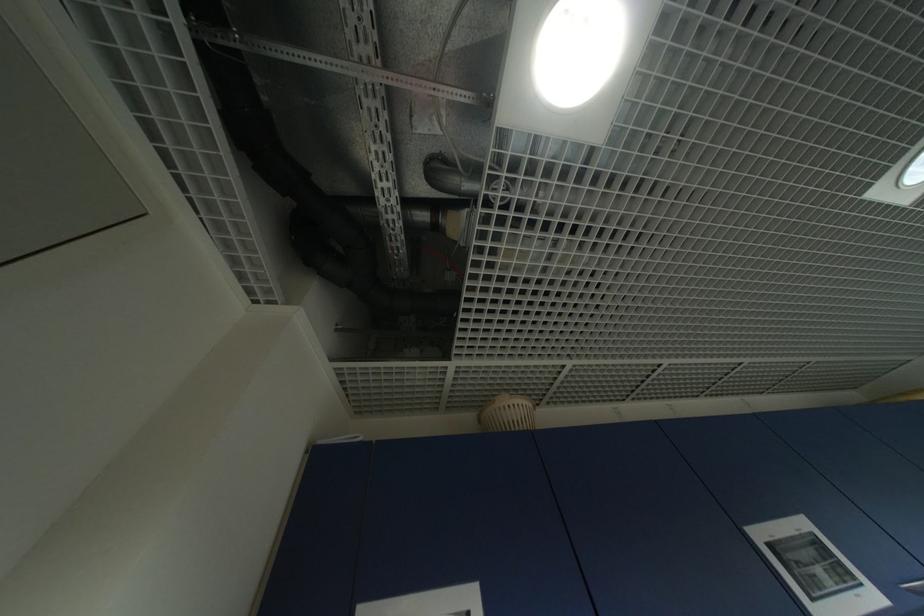
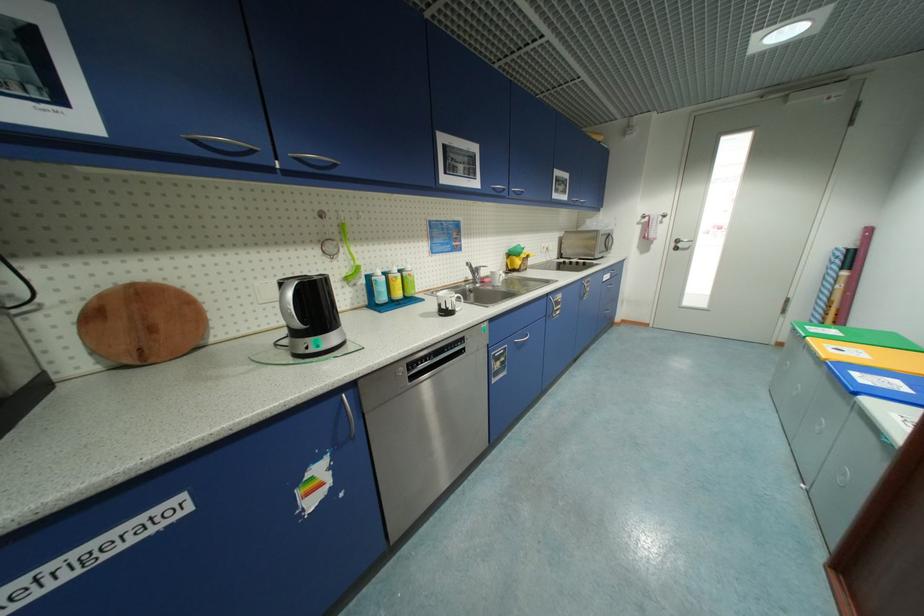
First-person continuous shooting, in which direction is the camera rotating?

→ The camera rotated toward right-down.